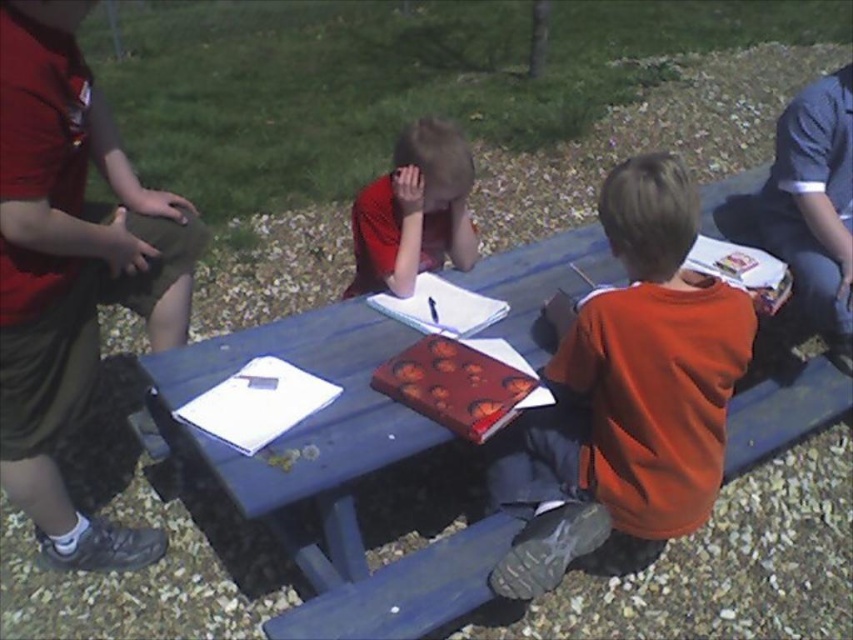
You are a parent trying to seat your child at the picnic table. The orange matte shirt at center is already seated. Is there enough space on the blue painted wood picnic table at center for another child?

The blue painted wood picnic table at center might be wider than orange matte shirt at center, so there could be enough space for another child to sit.

You are standing at the picnic area and want to reach the blue painted wood picnic table at center to place a snack. Considering your height is 5 feet, can you comfortably reach the table without needing to stand on something?

The blue painted wood picnic table at center is 4.79 feet away from the viewer. Since the table is at center and the distance is less than your height of 5 feet, you can comfortably reach it without needing to stand on something.

You are standing at a distance and want to take a photo of the blue painted wood picnic table at center. If your camera requires the subject to be at least 5 feet away for optimal focus, will the table be in focus?

The blue painted wood picnic table at center is 4.79 feet away from the camera, which is less than the required 5 feet for optimal focus. Therefore, the table may not be in focus.